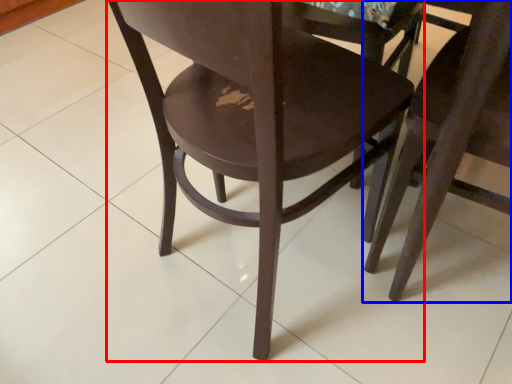
Question: Which point is closer to the camera, chair (highlighted by a red box) or chair (highlighted by a blue box)?

Choices:
 (A) chair
 (B) chair

Answer: (A)